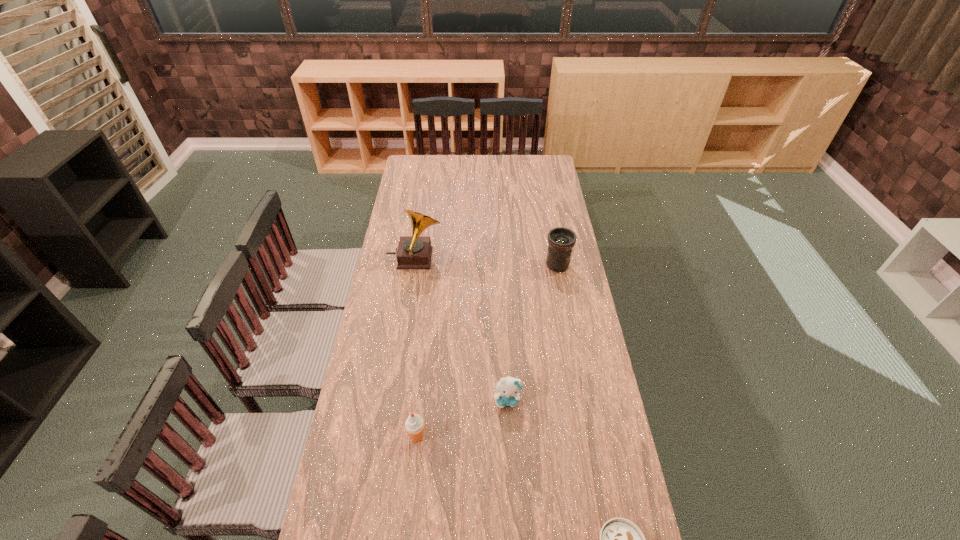
I want to click on object located at the left edge, so click(414, 252).

Locate an element on the screen. The image size is (960, 540). object located at the right edge is located at coordinates click(561, 240).

Locate an element on the screen. The image size is (960, 540). vacant space at the far edge of the desktop is located at coordinates (452, 166).

The width and height of the screenshot is (960, 540). I want to click on free space at the left edge of the desktop, so pyautogui.click(x=407, y=305).

You are a GUI agent. You are given a task and a screenshot of the screen. Output one action in this format:
    pyautogui.click(x=<x>, y=<y>)
    Task: Click on the free space at the right edge of the desktop
    
    Given the screenshot: What is the action you would take?
    pyautogui.click(x=572, y=407)

The width and height of the screenshot is (960, 540). In order to click on vacant space at the far left corner of the desktop in this screenshot , I will do `click(409, 170)`.

Find the location of a particular element. The width and height of the screenshot is (960, 540). vacant space that's between the third nearest object and the telephoto lens is located at coordinates (533, 333).

The height and width of the screenshot is (540, 960). I want to click on free point between the third object from left to right and the phonograph record, so click(x=461, y=329).

You are a GUI agent. You are given a task and a screenshot of the screen. Output one action in this format:
    pyautogui.click(x=<x>, y=<y>)
    Task: Click on the empty location between the fourth farthest object and the tallest object
    This screenshot has width=960, height=540.
    Given the screenshot: What is the action you would take?
    pyautogui.click(x=416, y=348)

The width and height of the screenshot is (960, 540). I want to click on vacant region between the third tallest object and the tallest object, so click(416, 348).